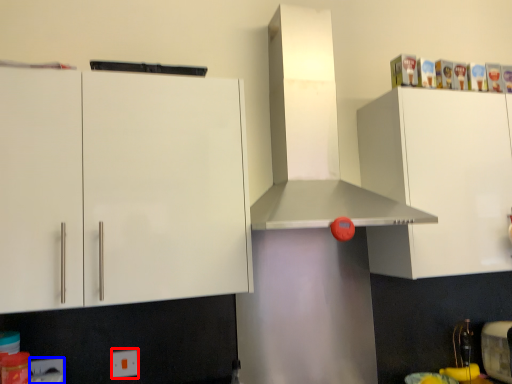
Question: Which of the following is the closest to the observer, electric outlet (highlighted by a red box) or electric outlet (highlighted by a blue box)?

Choices:
 (A) electric outlet
 (B) electric outlet

Answer: (B)